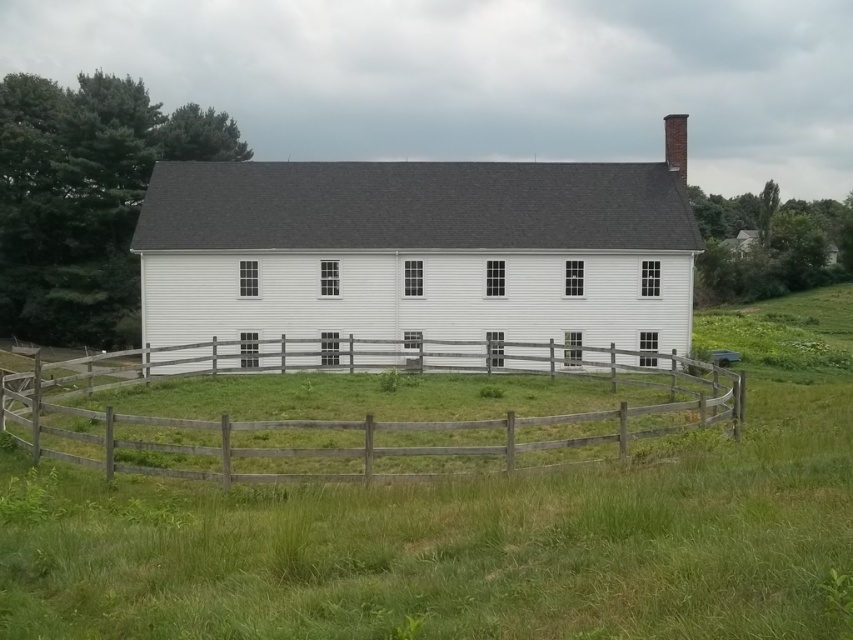
Question: Among these objects, which one is farthest from the camera?

Choices:
 (A) gray brick chimney at upper right
 (B) white wooden barn at center
 (C) wooden fence at center

Answer: (A)

Question: Is white wooden barn at center further to the viewer compared to gray brick chimney at upper right?

Choices:
 (A) no
 (B) yes

Answer: (A)

Question: Where is white wooden barn at center located in relation to wooden fence at center in the image?

Choices:
 (A) above
 (B) below

Answer: (A)

Question: Does wooden fence at center have a lesser width compared to gray brick chimney at upper right?

Choices:
 (A) no
 (B) yes

Answer: (A)

Question: Among these points, which one is farthest from the camera?

Choices:
 (A) (688, 115)
 (B) (346, 177)

Answer: (A)

Question: Which object appears farthest from the camera in this image?

Choices:
 (A) gray brick chimney at upper right
 (B) white wooden barn at center
 (C) wooden fence at center

Answer: (A)